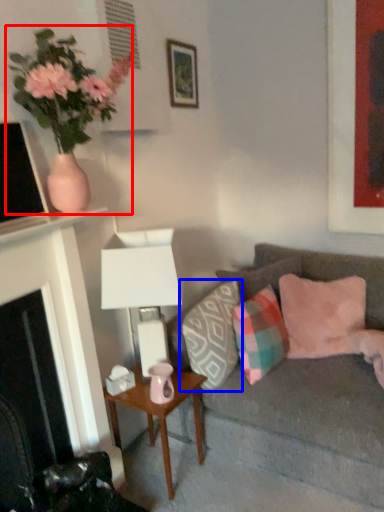
Question: Which point is further to the camera, houseplant (highlighted by a red box) or pillow (highlighted by a blue box)?

Choices:
 (A) houseplant
 (B) pillow

Answer: (B)